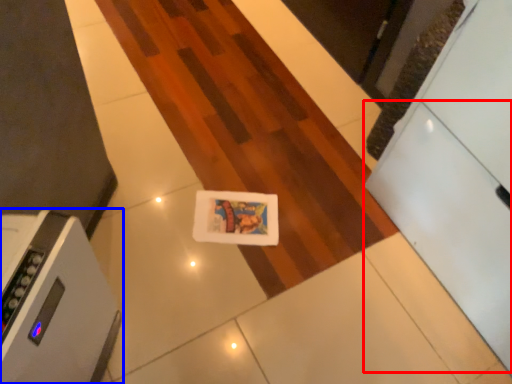
Question: Which object is further to the camera taking this photo, drawer (highlighted by a red box) or home appliance (highlighted by a blue box)?

Choices:
 (A) drawer
 (B) home appliance

Answer: (B)